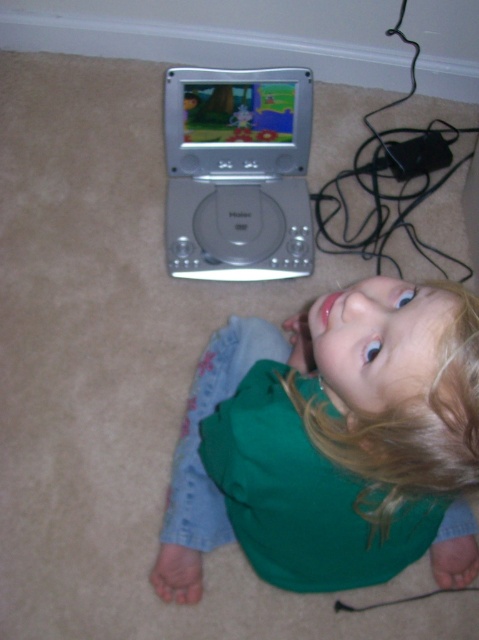
The child is looking at the DVD player. Is the green fabric shirt at lower center blocking the view of the silver metallic dvd player at upper center?

The green fabric shirt at lower center is in front of the silver metallic dvd player at upper center, so it is blocking the view of the DVD player.

The child is sitting on a beige carpeted floor. You see a point at coordinates (338,432). What object is located at that point?

The point at coordinates (338,432) indicates the green fabric shirt at lower center.